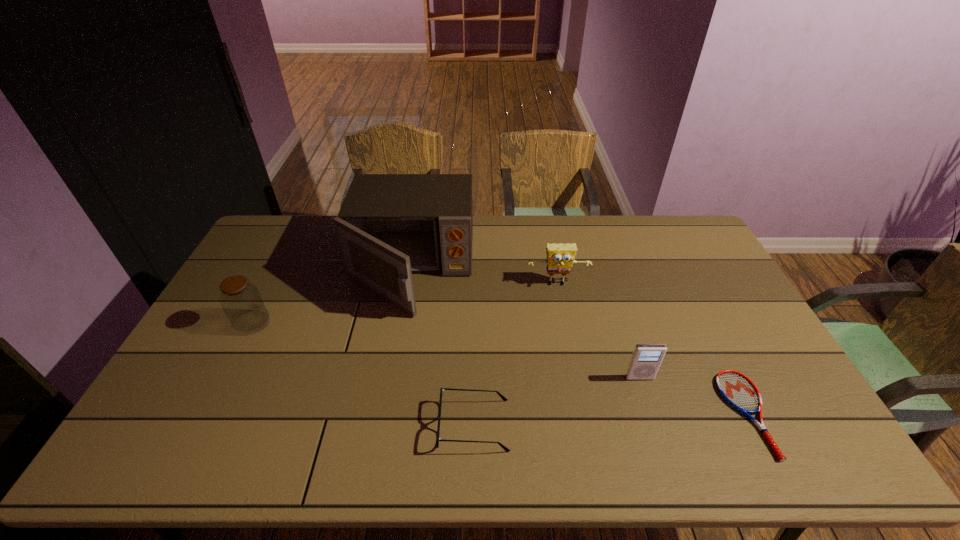
Identify the location of vacant space located on the front-facing side of the iPod. (655, 424).

Image resolution: width=960 pixels, height=540 pixels. I want to click on free location located with the lenses facing outward on the spectacles, so click(637, 425).

In order to click on vacant space located on the left of the shortest object in this screenshot , I will do `click(570, 414)`.

You are a GUI agent. You are given a task and a screenshot of the screen. Output one action in this format:
    pyautogui.click(x=<x>, y=<y>)
    Task: Click on the object at the far edge
    This screenshot has height=540, width=960.
    Given the screenshot: What is the action you would take?
    pyautogui.click(x=389, y=226)

Identify the location of spectacles that is at the near edge. The height and width of the screenshot is (540, 960). (506, 449).

The height and width of the screenshot is (540, 960). I want to click on tennis racket located at the near edge, so click(736, 389).

Identify the location of object present at the left edge. (241, 301).

Where is `object located in the right edge section of the desktop`? object located in the right edge section of the desktop is located at coordinates (736, 389).

The height and width of the screenshot is (540, 960). Find the location of `object at the near right corner`. object at the near right corner is located at coordinates (736, 389).

The width and height of the screenshot is (960, 540). In the image, there is a desktop. In order to click on vacant space at the far edge in this screenshot , I will do `click(581, 229)`.